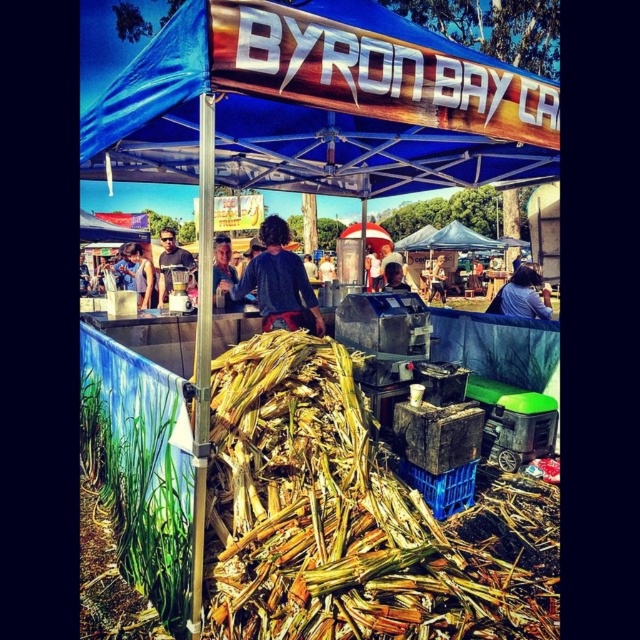
You are a customer at the Byron Bay market and want to reach the blender at the food stall. You are currently standing at point (x=140, y=301). There is an obstacle at point (x=426, y=508). Can you walk directly to the blender without going around the obstacle?

Point (x=426, y=508) is in front of point (x=140, y=301), so the obstacle is blocking your path. You will need to go around it to reach the blender.

You are standing at the entrance of the market and want to reach the smooth skin person at center under the blue fabric canopy at upper center. Which object is closer to you as you walk towards them?

The blue fabric canopy at upper center is closer to the viewer than the smooth skin person at center, so you would encounter the blue fabric canopy at upper center first as you walk towards them.

You are a photographer at the Byron Bay market. You want to take a photo of the matte black shirt at center and the smooth skin person at center so that both are fully visible. Given their heights, which one should you focus on to ensure the other is in frame?

The matte black shirt at center is not as tall as the smooth skin person at center. To ensure both are fully visible, focus on the taller smooth skin person at center, adjusting the camera angle to include the shorter matte black shirt at center in the frame.